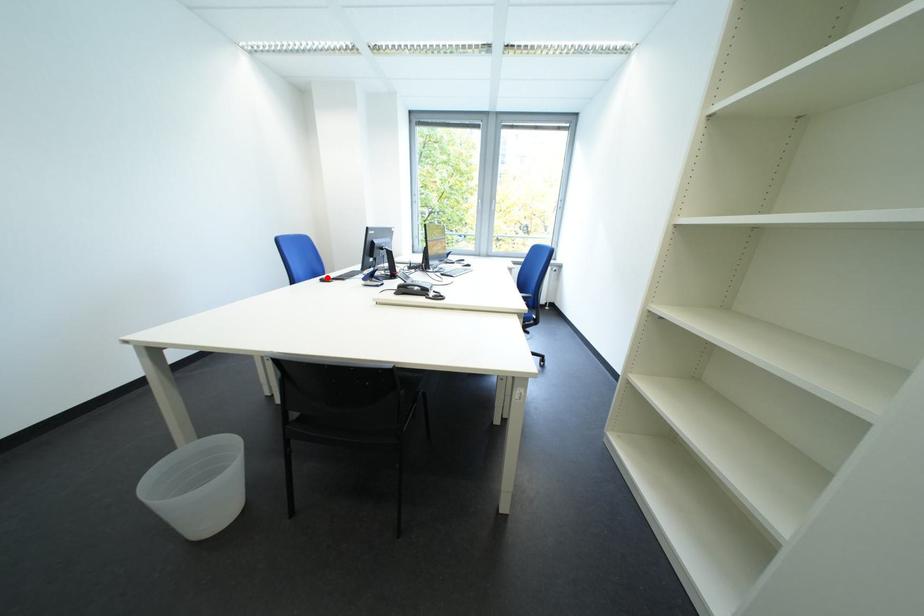
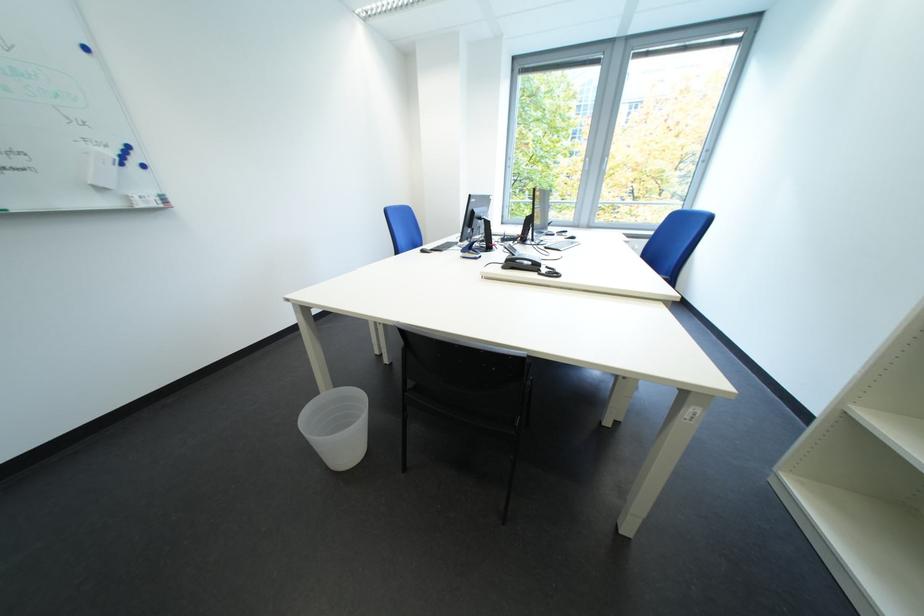
In the second image, find the point that corresponds to the highlighted location in the first image.

(427, 248)